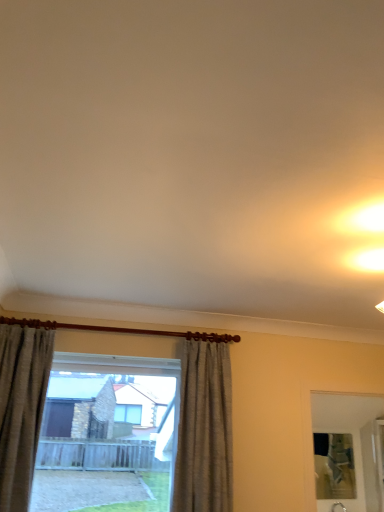
Question: Is point (193, 431) closer or farther from the camera than point (16, 417)?

Choices:
 (A) farther
 (B) closer

Answer: (A)

Question: Do you think clear glass window at center is within textured beige curtain at left, positioned as the 1th curtain in left-to-right order, or outside of it?

Choices:
 (A) inside
 (B) outside

Answer: (B)

Question: Estimate the real-world distances between objects in this image. Which object is farther from the clear glass window at center?

Choices:
 (A) textured beige curtain at left, which ranks as the 2th curtain in right-to-left order
 (B) gray fabric curtain at center, the 2th curtain positioned from the left

Answer: (A)

Question: Which object is the farthest from the textured beige curtain at left, which ranks as the 2th curtain in right-to-left order?

Choices:
 (A) clear glass window at center
 (B) gray fabric curtain at center, placed as the 1th curtain when sorted from right to left

Answer: (B)